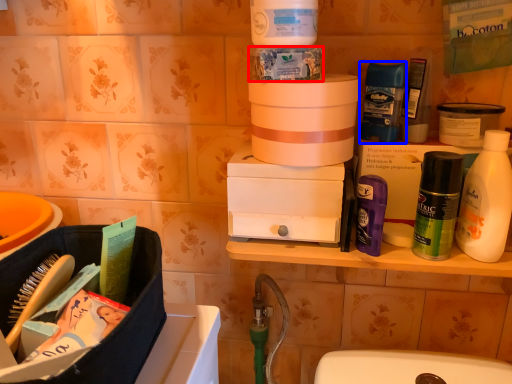
Question: Among these objects, which one is nearest to the camera, product (highlighted by a red box) or toiletry (highlighted by a blue box)?

Choices:
 (A) product
 (B) toiletry

Answer: (A)